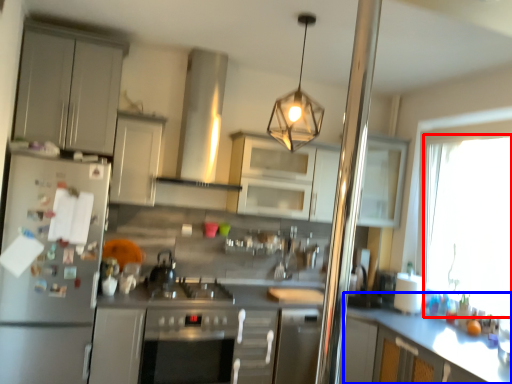
Question: Among these objects, which one is farthest to the camera, window (highlighted by a red box) or counter (highlighted by a blue box)?

Choices:
 (A) window
 (B) counter

Answer: (A)